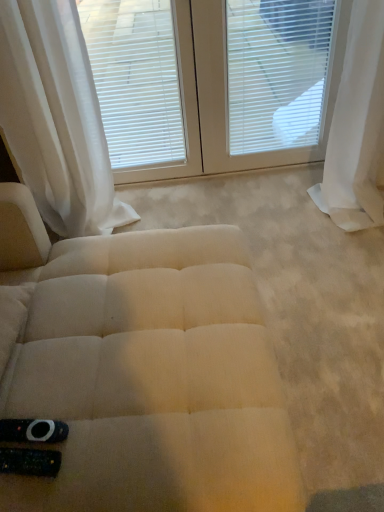
You are a GUI agent. You are given a task and a screenshot of the screen. Output one action in this format:
    pyautogui.click(x=<x>, y=<y>)
    Task: Click on the vacant area that is in front of white matte window blind at upper center
    
    Given the screenshot: What is the action you would take?
    pyautogui.click(x=170, y=204)